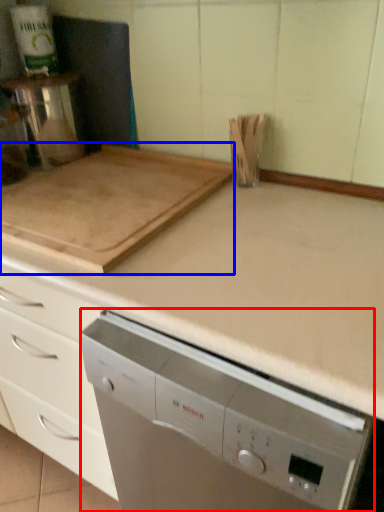
Question: Which object appears farthest to the camera in this image, home appliance (highlighted by a red box) or kitchen appliance (highlighted by a blue box)?

Choices:
 (A) home appliance
 (B) kitchen appliance

Answer: (B)